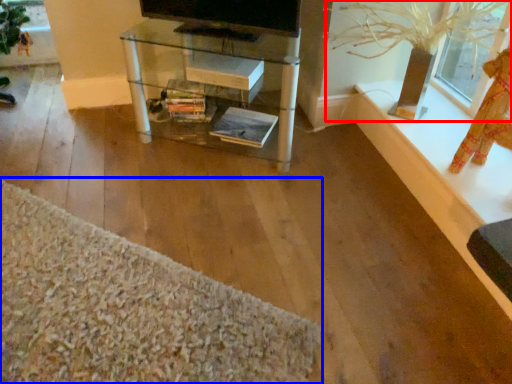
Question: Which of the following is the farthest to the observer, plant (highlighted by a red box) or plain (highlighted by a blue box)?

Choices:
 (A) plant
 (B) plain

Answer: (A)